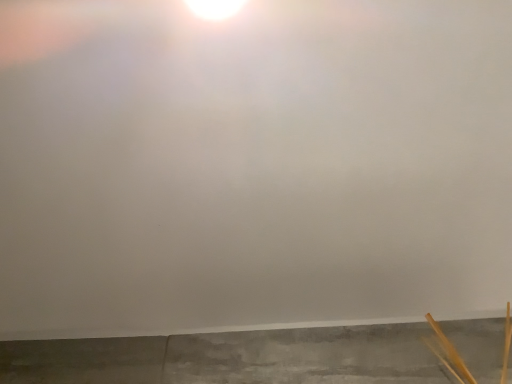
Measure the distance between white glossy light at upper center and camera.

They are 19.37 inches apart.

Measure the distance between point (231, 8) and camera.

19.69 inches.

Locate an element on the screen. white glossy light at upper center is located at coordinates (215, 8).

Describe the element at coordinates (215, 8) in the screenshot. I see `white glossy light at upper center` at that location.

Image resolution: width=512 pixels, height=384 pixels. In order to click on white glossy light at upper center in this screenshot , I will do `click(215, 8)`.